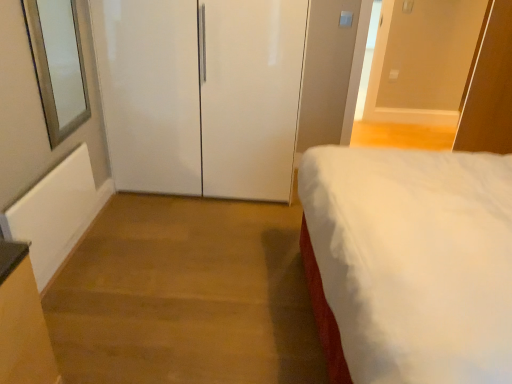
Question: Is the position of white glossy door at upper right, the first door when ordered from right to left, less distant than that of clear glass window at left?

Choices:
 (A) yes
 (B) no

Answer: (B)

Question: From the image's perspective, would you say white glossy door at upper right, the 2th door viewed from the left, is positioned over clear glass window at left?

Choices:
 (A) no
 (B) yes

Answer: (B)

Question: Is clear glass window at left a part of white glossy door at upper right, the 2th door viewed from the left?

Choices:
 (A) yes
 (B) no

Answer: (B)

Question: Does white glossy door at upper right, the first door when ordered from right to left, have a smaller size compared to clear glass window at left?

Choices:
 (A) yes
 (B) no

Answer: (B)

Question: From a real-world perspective, is white glossy door at upper right, the 2th door viewed from the left, under clear glass window at left?

Choices:
 (A) yes
 (B) no

Answer: (A)

Question: Is white glossy door at upper right, the 2th door viewed from the left, oriented away from clear glass window at left?

Choices:
 (A) yes
 (B) no

Answer: (B)

Question: Does clear glass window at left have a lesser width compared to white soft bed at right?

Choices:
 (A) yes
 (B) no

Answer: (A)

Question: Is clear glass window at left facing towards white soft bed at right?

Choices:
 (A) no
 (B) yes

Answer: (B)

Question: Is clear glass window at left outside of white soft bed at right?

Choices:
 (A) yes
 (B) no

Answer: (A)

Question: Is clear glass window at left at the left side of white soft bed at right?

Choices:
 (A) no
 (B) yes

Answer: (B)

Question: Is clear glass window at left further to camera compared to white soft bed at right?

Choices:
 (A) no
 (B) yes

Answer: (B)

Question: Is clear glass window at left positioned far away from white soft bed at right?

Choices:
 (A) yes
 (B) no

Answer: (A)

Question: Is white glossy door at center, the 1th door positioned from the left, positioned beyond the bounds of white glossy door at upper right, the 2th door viewed from the left?

Choices:
 (A) no
 (B) yes

Answer: (B)